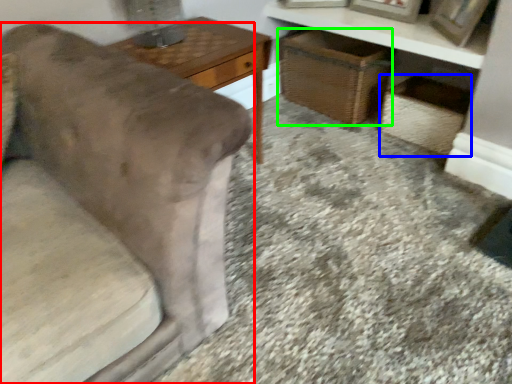
Question: Based on their relative distances, which object is nearer to furniture (highlighted by a red box)? Choose from crate (highlighted by a blue box) and basket (highlighted by a green box).

Choices:
 (A) crate
 (B) basket

Answer: (B)